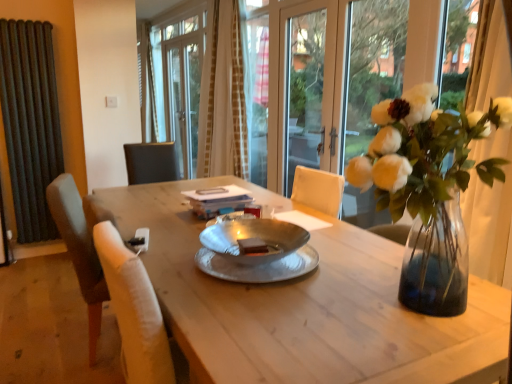
Question: Is dark gray radiator at left far away from wooden table at center?

Choices:
 (A) yes
 (B) no

Answer: (A)

Question: From a real-world perspective, does dark gray radiator at left sit lower than wooden table at center?

Choices:
 (A) no
 (B) yes

Answer: (A)

Question: Considering the relative sizes of dark gray radiator at left and wooden table at center in the image provided, is dark gray radiator at left wider than wooden table at center?

Choices:
 (A) no
 (B) yes

Answer: (A)

Question: Is dark gray radiator at left taller than wooden table at center?

Choices:
 (A) no
 (B) yes

Answer: (B)

Question: Does dark gray radiator at left touch wooden table at center?

Choices:
 (A) no
 (B) yes

Answer: (A)

Question: From the image's perspective, is dark gray radiator at left on top of wooden table at center?

Choices:
 (A) no
 (B) yes

Answer: (B)

Question: Is beige textured curtain at upper center facing towards wooden table at center?

Choices:
 (A) yes
 (B) no

Answer: (B)

Question: Is beige textured curtain at upper center not within wooden table at center?

Choices:
 (A) yes
 (B) no

Answer: (A)

Question: From the image's perspective, is beige textured curtain at upper center on top of wooden table at center?

Choices:
 (A) no
 (B) yes

Answer: (B)

Question: Considering the relative sizes of beige textured curtain at upper center and wooden table at center in the image provided, is beige textured curtain at upper center smaller than wooden table at center?

Choices:
 (A) no
 (B) yes

Answer: (B)

Question: Is beige textured curtain at upper center further to the viewer compared to wooden table at center?

Choices:
 (A) yes
 (B) no

Answer: (A)

Question: Is wooden table at center at the back of beige textured curtain at upper center?

Choices:
 (A) yes
 (B) no

Answer: (B)

Question: Is transparent glass door at center smaller than clear glass vase at upper right?

Choices:
 (A) yes
 (B) no

Answer: (A)